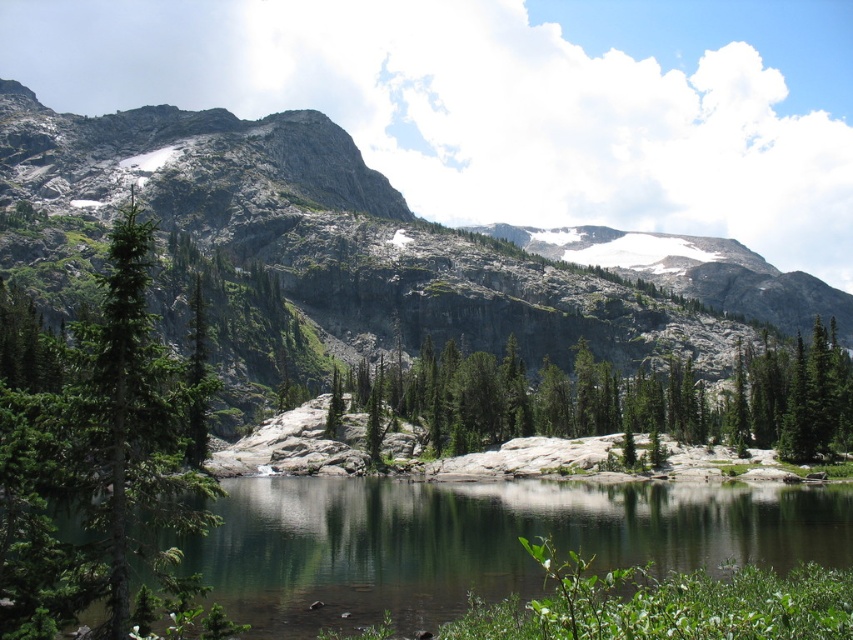
You are standing at the edge of the lake and want to compare the heights of the clear water at center and the green matte tree at left. Which one is taller?

The green matte tree at left is taller than the clear water at center.

You are an artist planning to paint the scene. You want to ensure the green matte tree at left and the green textured rock at center are proportionally accurate. Which object should you paint larger?

The green matte tree at left should be painted larger since it has a larger size compared to the green textured rock at center according to the description.

You are a hiker who wants to cross the lake at the center. The coordinates given are in a system where the bottom left corner is the origin point. What is the exact location of the clear water at center where you should aim to cross?

The clear water at center is located at coordinates point (480,541).